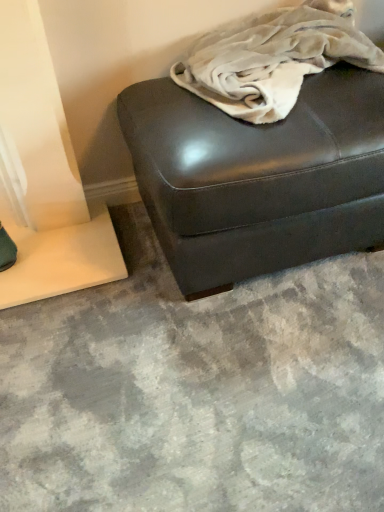
Measure the distance between point (x=329, y=181) and camera.

The distance of point (x=329, y=181) from camera is 38.31 inches.

This screenshot has height=512, width=384. Identify the location of shiny dark brown ottoman at center. (259, 177).

What do you see at coordinates (259, 177) in the screenshot?
I see `shiny dark brown ottoman at center` at bounding box center [259, 177].

What is the approximate height of white cotton blanket at center?

It is 14.65 inches.

This screenshot has height=512, width=384. In order to click on white cotton blanket at center in this screenshot , I will do `click(273, 58)`.

Describe the element at coordinates (273, 58) in the screenshot. Image resolution: width=384 pixels, height=512 pixels. I see `white cotton blanket at center` at that location.

Where is `shiny dark brown ottoman at center`? shiny dark brown ottoman at center is located at coordinates (259, 177).

Is shiny dark brown ottoman at center to the right of white cotton blanket at center from the viewer's perspective?

No.

Is shiny dark brown ottoman at center positioned in front of white cotton blanket at center?

No, shiny dark brown ottoman at center is further to the viewer.

Considering the positions of points (180, 172) and (283, 27), is point (180, 172) closer to camera compared to point (283, 27)?

That is True.

From the image's perspective, is shiny dark brown ottoman at center located above white cotton blanket at center?

No, from the image's perspective, shiny dark brown ottoman at center is not over white cotton blanket at center.

From a real-world perspective, is shiny dark brown ottoman at center physically below white cotton blanket at center?

Yes, from a real-world perspective, shiny dark brown ottoman at center is below white cotton blanket at center.

Does shiny dark brown ottoman at center have a greater width compared to white cotton blanket at center?

Yes, shiny dark brown ottoman at center is wider than white cotton blanket at center.

Which of these two, shiny dark brown ottoman at center or white cotton blanket at center, stands shorter?

white cotton blanket at center.

Is shiny dark brown ottoman at center smaller than white cotton blanket at center?

No, shiny dark brown ottoman at center is not smaller than white cotton blanket at center.

Is shiny dark brown ottoman at center inside or outside of white cotton blanket at center?

shiny dark brown ottoman at center lies outside white cotton blanket at center.

Is shiny dark brown ottoman at center directly adjacent to white cotton blanket at center?

No.

Is white cotton blanket at center at the back of shiny dark brown ottoman at center?

No, shiny dark brown ottoman at center is not facing away from white cotton blanket at center.

What's the angular difference between shiny dark brown ottoman at center and white cotton blanket at center's facing directions?

0.817 degrees.

I want to click on blanket in front of the shiny dark brown ottoman at center, so click(273, 58).

Between white cotton blanket at center and shiny dark brown ottoman at center, which one appears on the right side from the viewer's perspective?

white cotton blanket at center.

Consider the image. Is white cotton blanket at center further to the viewer compared to shiny dark brown ottoman at center?

That is False.

Is point (206, 78) positioned after point (372, 84)?

No, it is not.

From the image's perspective, between white cotton blanket at center and shiny dark brown ottoman at center, who is located below?

shiny dark brown ottoman at center, from the image's perspective.

From a real-world perspective, between white cotton blanket at center and shiny dark brown ottoman at center, who is vertically higher?

white cotton blanket at center, from a real-world perspective.

Is white cotton blanket at center thinner than shiny dark brown ottoman at center?

Yes, white cotton blanket at center is thinner than shiny dark brown ottoman at center.

Can you confirm if white cotton blanket at center is shorter than shiny dark brown ottoman at center?

→ Correct, white cotton blanket at center is not as tall as shiny dark brown ottoman at center.

In terms of size, does white cotton blanket at center appear bigger or smaller than shiny dark brown ottoman at center?

white cotton blanket at center is smaller than shiny dark brown ottoman at center.

Is white cotton blanket at center inside or outside of shiny dark brown ottoman at center?

white cotton blanket at center is spatially positioned inside shiny dark brown ottoman at center.

From the picture: Would you say white cotton blanket at center is a long distance from shiny dark brown ottoman at center?

No, white cotton blanket at center is not far from shiny dark brown ottoman at center.

Is white cotton blanket at center looking in the opposite direction of shiny dark brown ottoman at center?

Yes, white cotton blanket at center's orientation is away from shiny dark brown ottoman at center.

How different are the orientations of white cotton blanket at center and shiny dark brown ottoman at center in degrees?

The angle between the facing direction of white cotton blanket at center and the facing direction of shiny dark brown ottoman at center is 0.817 degrees.

Identify the location of blanket above the shiny dark brown ottoman at center (from a real-world perspective). Image resolution: width=384 pixels, height=512 pixels. (273, 58).

You are a GUI agent. You are given a task and a screenshot of the screen. Output one action in this format:
    pyautogui.click(x=<x>, y=<y>)
    Task: Click on the blanket above the shiny dark brown ottoman at center (from the image's perspective)
    This screenshot has height=512, width=384.
    Given the screenshot: What is the action you would take?
    pyautogui.click(x=273, y=58)

Image resolution: width=384 pixels, height=512 pixels. Identify the location of blanket on the right of shiny dark brown ottoman at center. (273, 58).